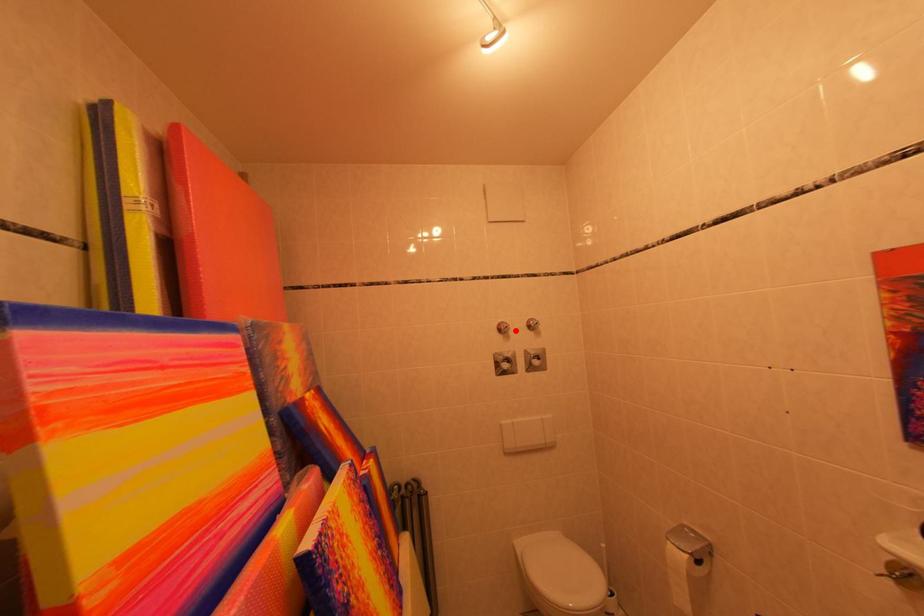
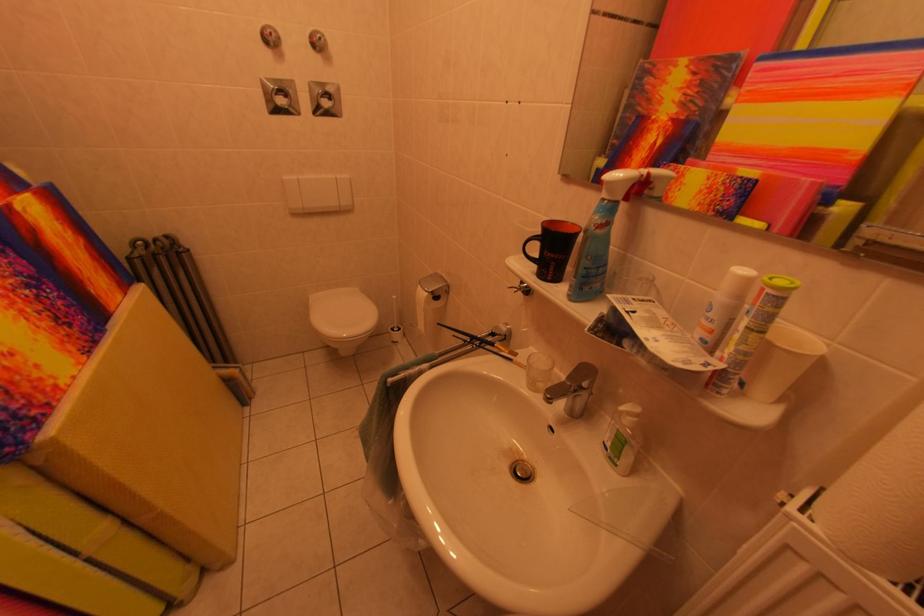
Find the pixel in the second image that matches the highlighted location in the first image.

(278, 39)